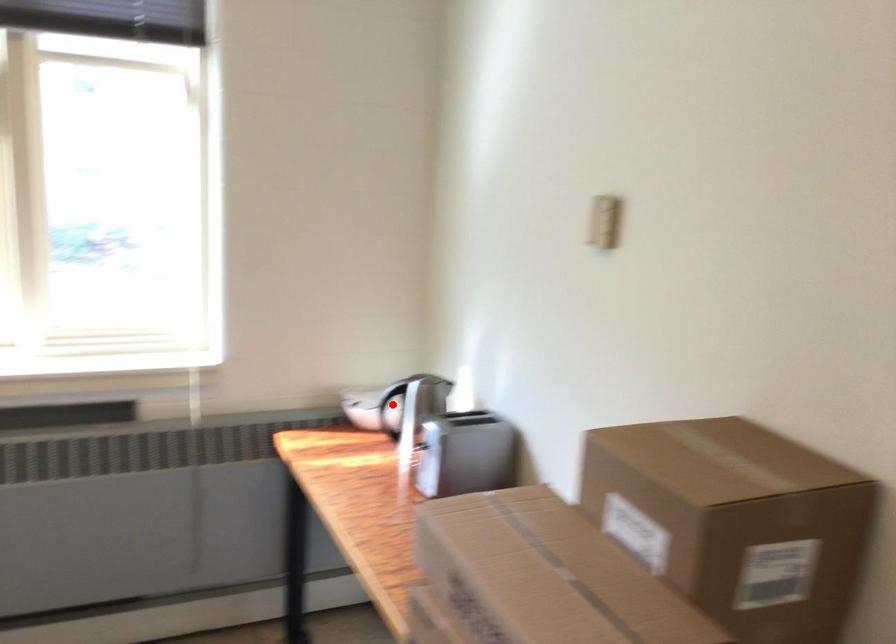
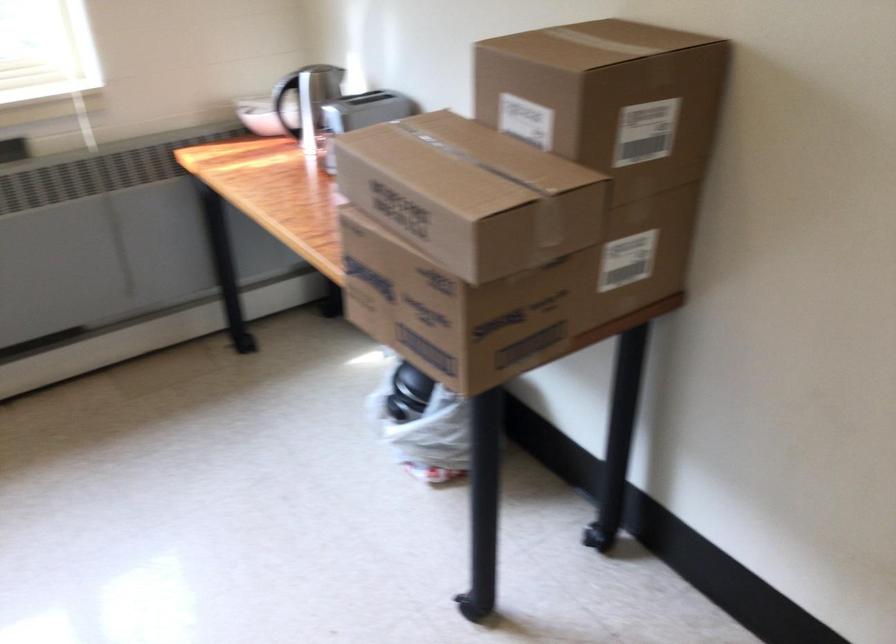
Where in the second image is the point corresponding to the highlighted location from the first image?

(285, 100)